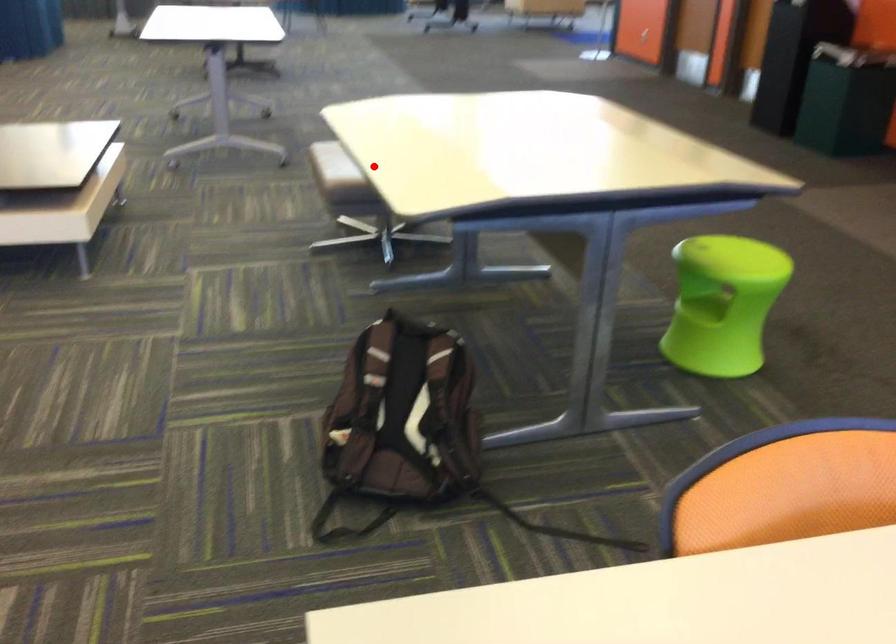
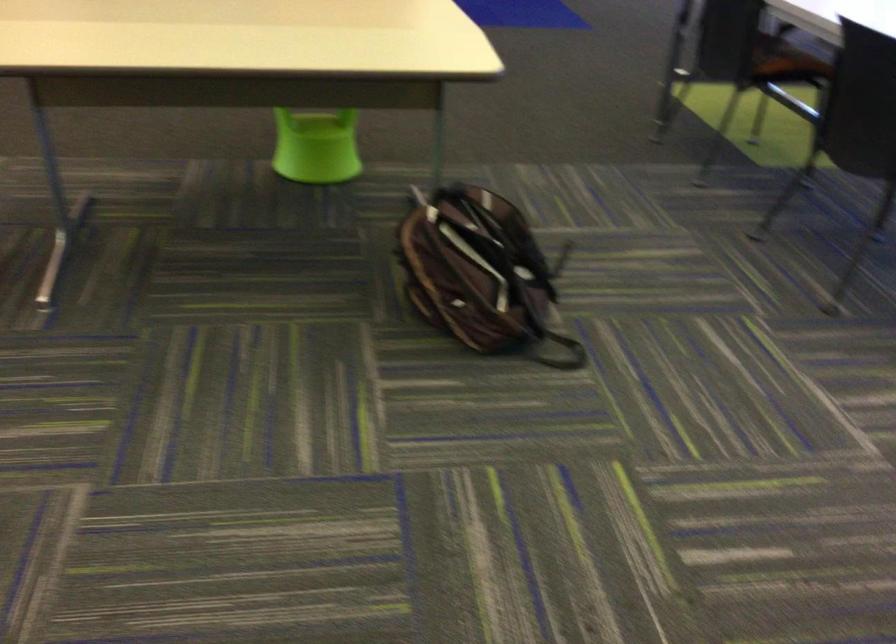
Question: I am providing you with two images of the same scene from different viewpoints. In image1, a red point is highlighted. Considering the same 3D point in image2, which of the following is correct?

Choices:
 (A) It is closer
 (B) It is farther

Answer: (A)